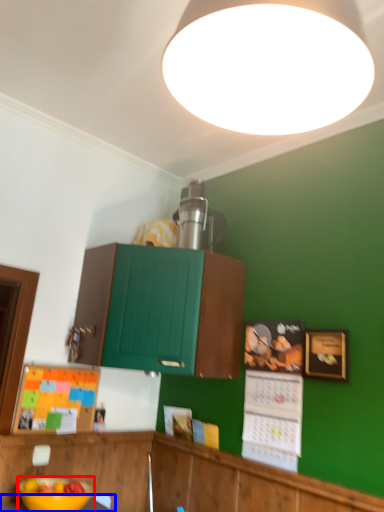
Question: Which object appears farthest to the camera in this image, bowl (highlighted by a red box) or table (highlighted by a blue box)?

Choices:
 (A) bowl
 (B) table

Answer: (A)